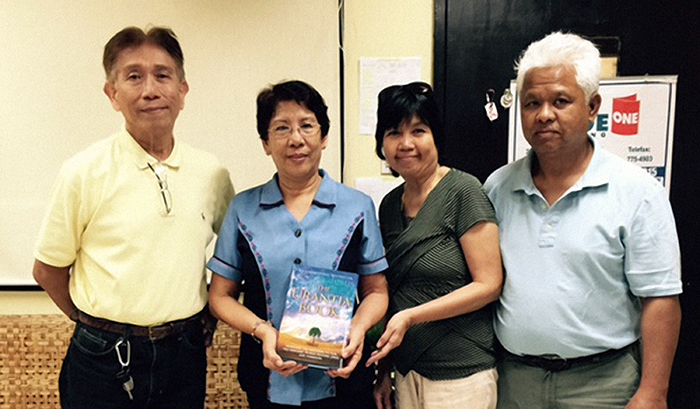
You are a GUI agent. You are given a task and a screenshot of the screen. Output one action in this format:
    pyautogui.click(x=<x>, y=<y>)
    Task: Click on the keys
    The width and height of the screenshot is (700, 409).
    Given the screenshot: What is the action you would take?
    pyautogui.click(x=122, y=377)